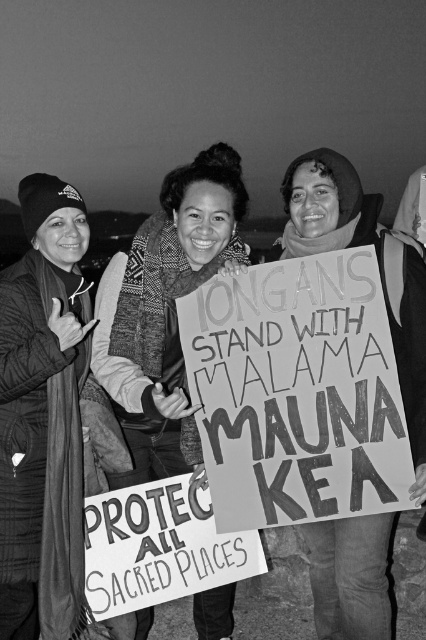
Question: Can you confirm if plaid wool scarf at left is smaller than matte cardboard sign at center?

Choices:
 (A) no
 (B) yes

Answer: (A)

Question: Does handwritten cardboard sign at center appear on the right side of plaid wool scarf at left?

Choices:
 (A) no
 (B) yes

Answer: (B)

Question: Which point is closer to the camera?

Choices:
 (A) plaid wool scarf at left
 (B) handwritten cardboard sign at center

Answer: (B)

Question: Which of the following is the closest to the observer?

Choices:
 (A) knitted scarf at center
 (B) plaid wool scarf at left
 (C) matte cardboard sign at center
 (D) handwritten cardboard sign at center

Answer: (D)

Question: Which object is closer to the camera taking this photo?

Choices:
 (A) handwritten cardboard sign at center
 (B) matte cardboard sign at center
 (C) plaid wool scarf at left

Answer: (A)

Question: Can you confirm if plaid wool scarf at left is thinner than matte cardboard sign at center?

Choices:
 (A) yes
 (B) no

Answer: (A)